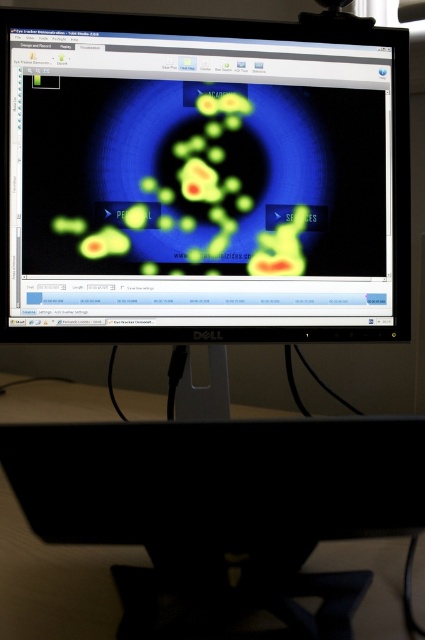
Question: Does matte plastic monitor at center appear on the right side of wooden table at bottom?

Choices:
 (A) yes
 (B) no

Answer: (A)

Question: Which of the following is the closest to the observer?

Choices:
 (A) (8, 17)
 (B) (371, 593)

Answer: (B)

Question: Is matte plastic monitor at center above wooden table at bottom?

Choices:
 (A) yes
 (B) no

Answer: (A)

Question: Is matte plastic monitor at center to the right of wooden table at bottom from the viewer's perspective?

Choices:
 (A) yes
 (B) no

Answer: (A)

Question: Among these objects, which one is nearest to the camera?

Choices:
 (A) matte plastic monitor at center
 (B) wooden table at bottom

Answer: (A)